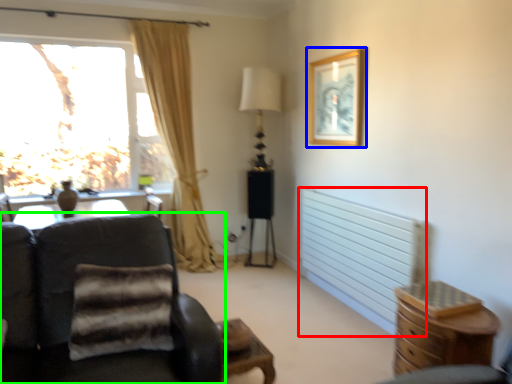
Question: Estimate the real-world distances between objects in this image. Which object is farther from radiator (highlighted by a red box), picture frame (highlighted by a blue box) or chair (highlighted by a green box)?

Choices:
 (A) picture frame
 (B) chair

Answer: (B)